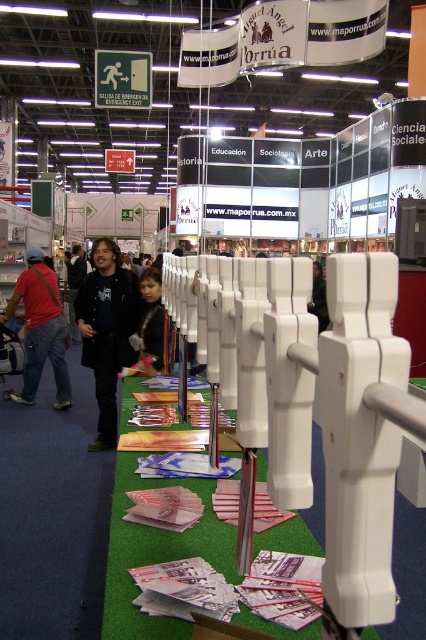
Question: Is matte black jacket at center above black fabric at center?

Choices:
 (A) no
 (B) yes

Answer: (B)

Question: Which point is farther to the camera?

Choices:
 (A) black matte jacket at left
 (B) dark brown hair at center

Answer: (A)

Question: Which of the following is the closest to the observer?

Choices:
 (A) (100, 371)
 (B) (71, 266)
 (C) (132, 337)

Answer: (C)

Question: Which is farther from the black matte jacket at left?

Choices:
 (A) black fabric at center
 (B) matte red shirt at left
 (C) matte black jacket at center
 (D) dark brown hair at center

Answer: (C)

Question: Does matte black jacket at center appear under black fabric at center?

Choices:
 (A) no
 (B) yes

Answer: (A)

Question: Can you confirm if black matte jacket at left is positioned above dark brown hair at center?

Choices:
 (A) no
 (B) yes

Answer: (A)